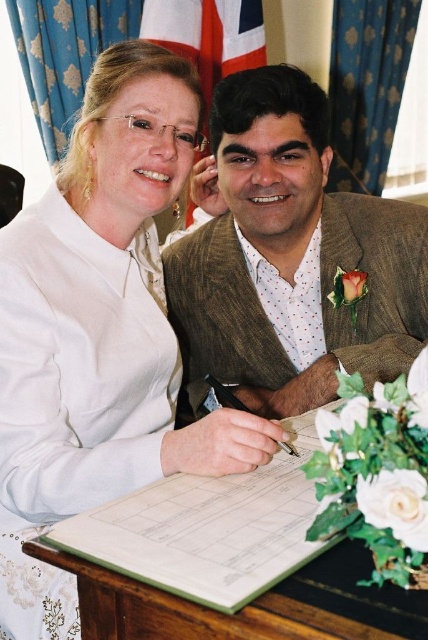
Question: Which is nearer to the white matte shirt at upper left?

Choices:
 (A) wooden table at center
 (B) brown textured suit at center

Answer: (A)

Question: Which object is the farthest from the wooden table at center?

Choices:
 (A) white matte shirt at upper left
 (B) brown textured suit at center

Answer: (B)

Question: Which object is closer to the camera taking this photo?

Choices:
 (A) brown textured suit at center
 (B) white matte shirt at upper left
 (C) wooden table at center

Answer: (C)

Question: Is the position of brown textured suit at center more distant than that of wooden table at center?

Choices:
 (A) no
 (B) yes

Answer: (B)

Question: Considering the relative positions of white matte shirt at upper left and brown textured suit at center in the image provided, where is white matte shirt at upper left located with respect to brown textured suit at center?

Choices:
 (A) left
 (B) right

Answer: (A)

Question: Can you confirm if white matte shirt at upper left is wider than brown textured suit at center?

Choices:
 (A) yes
 (B) no

Answer: (B)